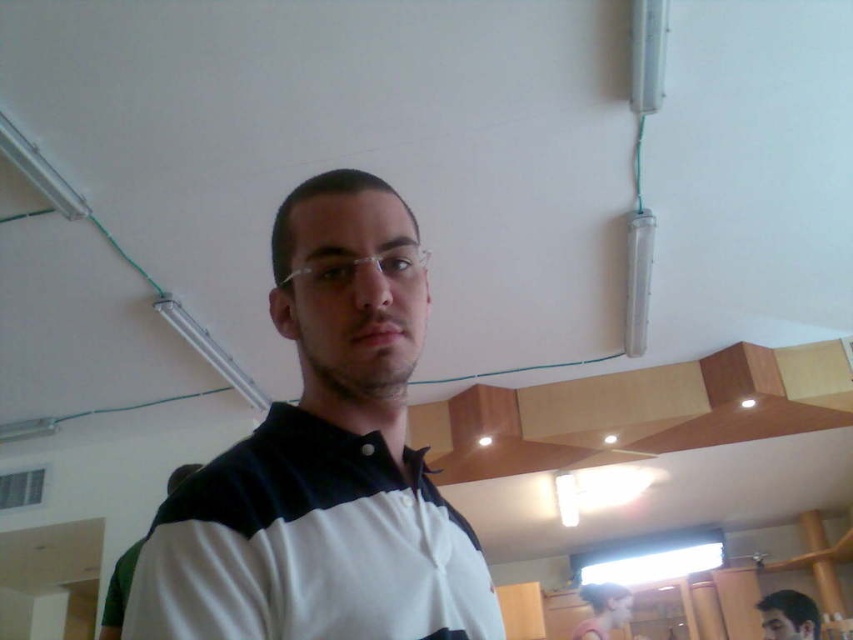
Can you confirm if white matte shirt at center is positioned above smooth brown hair at lower right?

Indeed, white matte shirt at center is positioned over smooth brown hair at lower right.

Between white matte shirt at center and smooth brown hair at lower right, which one appears on the right side from the viewer's perspective?

smooth brown hair at lower right

Where is `white matte shirt at center`? The image size is (853, 640). white matte shirt at center is located at coordinates (323, 467).

Find the location of a particular element. This screenshot has width=853, height=640. white matte shirt at center is located at coordinates (323, 467).

Can you confirm if smooth brown hair at lower right is positioned below white striped polo shirt at center?

Correct, smooth brown hair at lower right is located below white striped polo shirt at center.

Who is more distant from viewer, (816, 616) or (181, 477)?

The point (816, 616) is behind.

Where is `smooth brown hair at lower right`? smooth brown hair at lower right is located at coordinates (788, 616).

Which is above, clear plastic glasses at center or smooth brown hair at lower right?

clear plastic glasses at center

Measure the distance between clear plastic glasses at center and smooth brown hair at lower right.

clear plastic glasses at center is 9.22 feet away from smooth brown hair at lower right.

Is point (340, 269) more distant than point (767, 600)?

No, (340, 269) is in front of (767, 600).

Image resolution: width=853 pixels, height=640 pixels. Identify the location of clear plastic glasses at center. (358, 266).